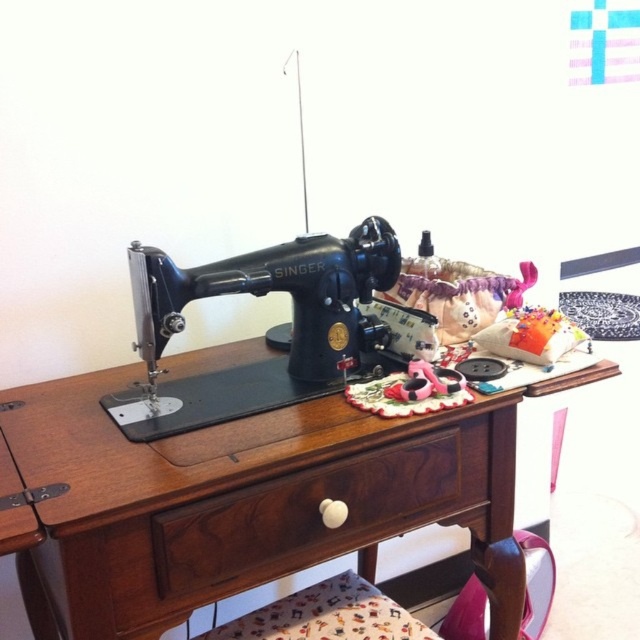
You are organizing the sewing table and need to access the brown wood drawer at center. The black metal sewing machine at center is blocking your path. Can you move the sewing machine to reach the drawer?

The brown wood drawer at center is behind the black metal sewing machine at center, so you need to move the sewing machine to access it.

Consider the image. You are organizing a sewing workshop and need to access the brown wood drawer at center. However, the black metal sewing machine at center is blocking your path. Can you reach the drawer without moving the sewing machine?

The black metal sewing machine at center is above the brown wood drawer at center, meaning the drawer is located underneath the sewing machine. Since the drawer is beneath the machine, you can pull it out from below without needing to move the sewing machine.

You are organizing a sewing workshop and need to place a large fabric roll next to the wooden sewing machine at center and the brown wood drawer at center. Given their sizes, which object should the fabric roll be placed next to to ensure it doesn

The wooden sewing machine at center is larger than the brown wood drawer at center, so the fabric roll should be placed next to the wooden sewing machine at center to accommodate its size.